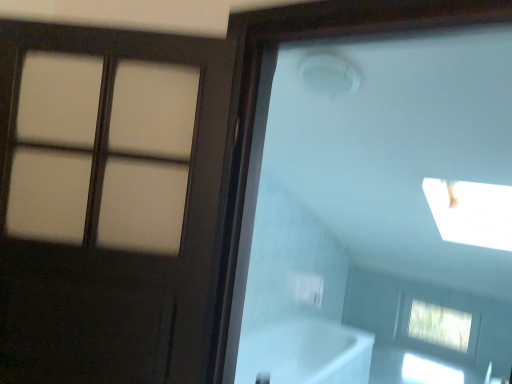
Question: Looking at their shapes, would you say white glossy bathtub at lower center is wider or thinner than clear glass window at lower right?

Choices:
 (A) wide
 (B) thin

Answer: (A)

Question: In terms of height, does white glossy bathtub at lower center look taller or shorter compared to clear glass window at lower right?

Choices:
 (A) tall
 (B) short

Answer: (A)

Question: Which object is positioned farthest from the clear glass window at lower right?

Choices:
 (A) matte brown door at left
 (B) white glossy bathtub at lower center

Answer: (A)

Question: Which of these objects is positioned farthest from the clear glass window at lower right?

Choices:
 (A) white glossy bathtub at lower center
 (B) matte brown door at left

Answer: (B)